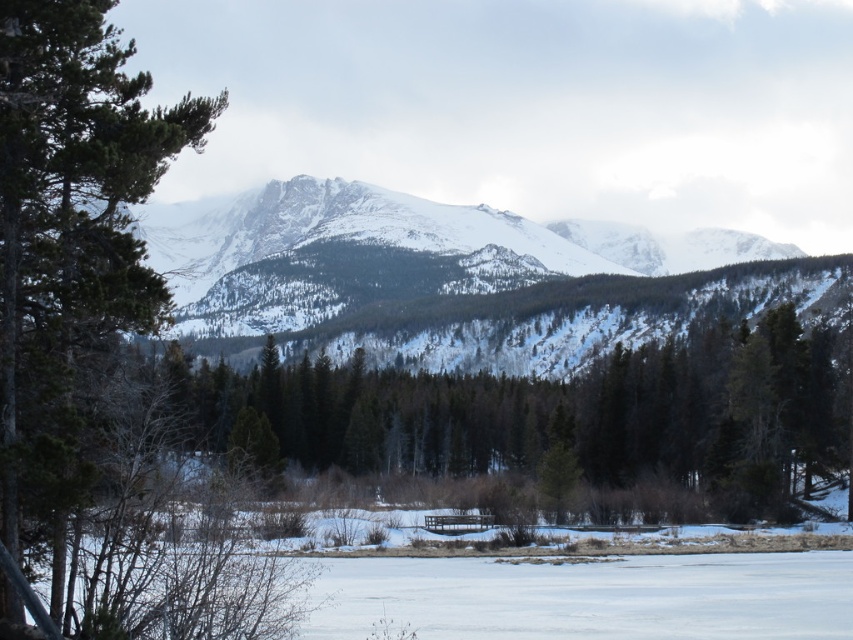
Question: Does green textured pine tree at left appear over snowy rocky mountain at center?

Choices:
 (A) yes
 (B) no

Answer: (B)

Question: Does green matte tree at center have a smaller size compared to green textured pine tree at left?

Choices:
 (A) no
 (B) yes

Answer: (A)

Question: Is green matte tree at center further to the viewer compared to snowy rocky mountain at center?

Choices:
 (A) no
 (B) yes

Answer: (A)

Question: Estimate the real-world distances between objects in this image. Which object is farther from the green matte tree at center?

Choices:
 (A) green textured pine tree at left
 (B) snowy rocky mountain at center

Answer: (B)

Question: Which of the following is the farthest from the observer?

Choices:
 (A) snowy rocky mountain at center
 (B) green textured pine tree at left

Answer: (A)

Question: Which is farther from the green matte tree at center?

Choices:
 (A) green textured pine tree at left
 (B) snowy rocky mountain at center

Answer: (B)